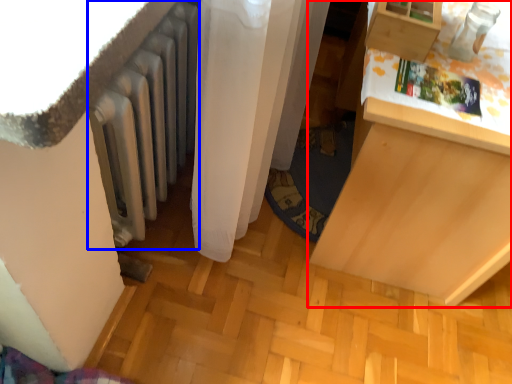
Question: Which of the following is the farthest to the observer, furniture (highlighted by a red box) or radiator (highlighted by a blue box)?

Choices:
 (A) furniture
 (B) radiator

Answer: (A)